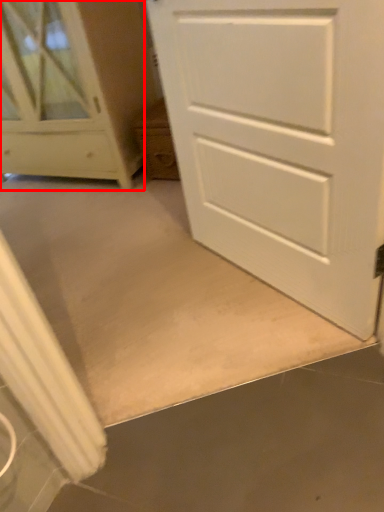
Question: From the image's perspective, where is chest of drawers (annotated by the red box) located in relation to door in the image?

Choices:
 (A) below
 (B) above

Answer: (B)